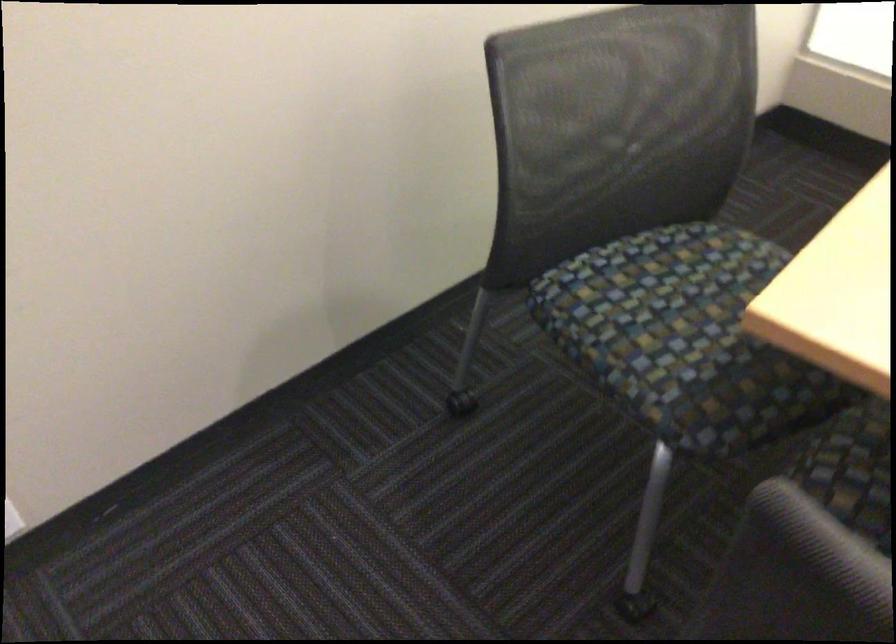
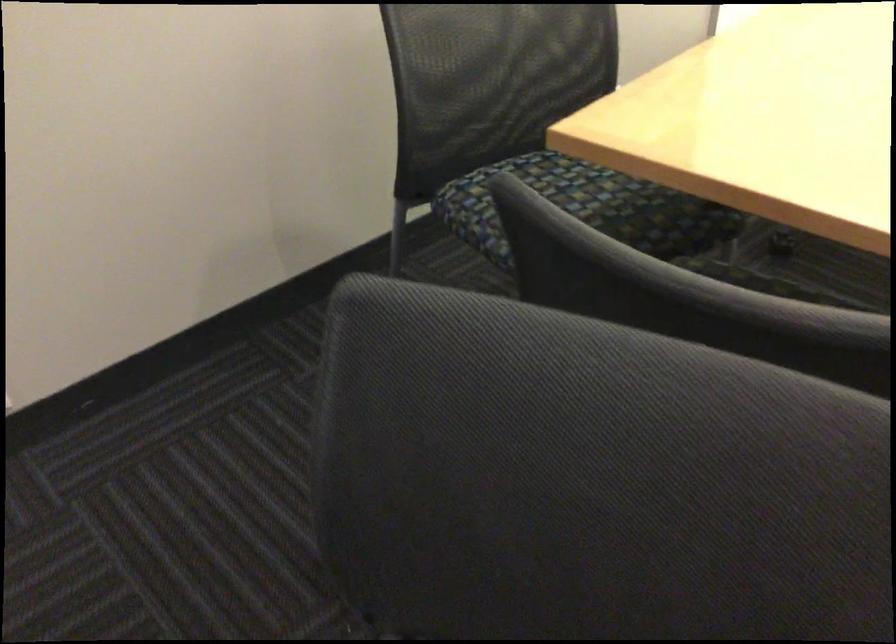
Question: The first image is from the beginning of the video and the second image is from the end. How did the camera likely rotate when shooting the video?

Choices:
 (A) Left
 (B) Right
 (C) Up
 (D) Down

Answer: (C)